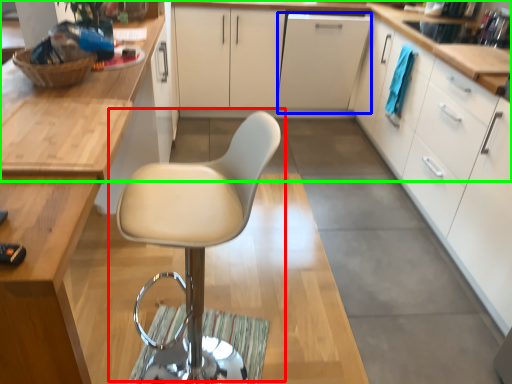
Question: Considering the real-world distances, which object is closest to chair (highlighted by a red box)? file cabinet (highlighted by a blue box) or countertop (highlighted by a green box).

Choices:
 (A) file cabinet
 (B) countertop

Answer: (B)